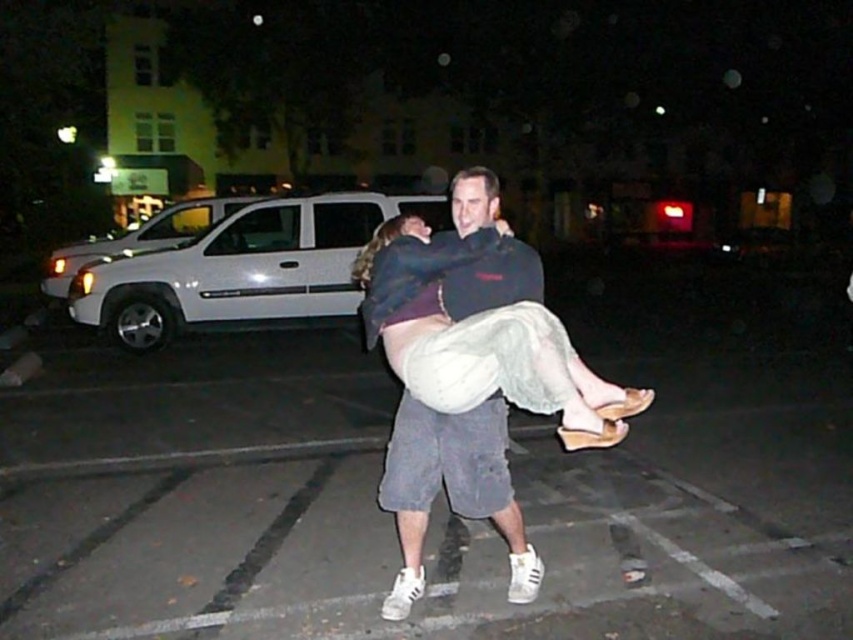
Question: Does gray asphalt parking lot at center have a lesser width compared to white matte suv at left?

Choices:
 (A) yes
 (B) no

Answer: (B)

Question: Which of the following is the closest to the observer?

Choices:
 (A) (84, 244)
 (B) (207, 253)

Answer: (B)

Question: Which point is closer to the camera?

Choices:
 (A) gray asphalt parking lot at center
 (B) white matte van at center
 (C) white matte suv at left

Answer: (A)

Question: Which object is the closest to the white matte suv at left?

Choices:
 (A) white matte van at center
 (B) gray asphalt parking lot at center

Answer: (A)

Question: Is white matte van at center thinner than white matte suv at left?

Choices:
 (A) yes
 (B) no

Answer: (B)

Question: Can you confirm if white matte van at center is positioned to the right of white matte suv at left?

Choices:
 (A) no
 (B) yes

Answer: (B)